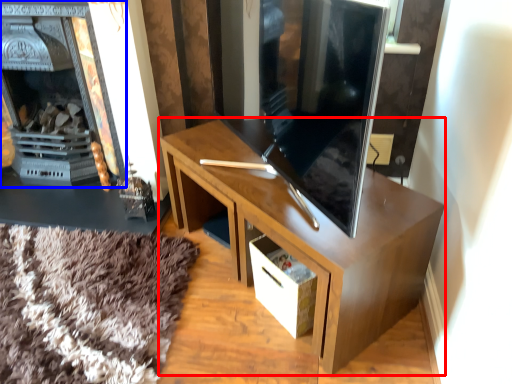
Question: Which point is closer to the camera, desk (highlighted by a red box) or fireplace (highlighted by a blue box)?

Choices:
 (A) desk
 (B) fireplace

Answer: (A)